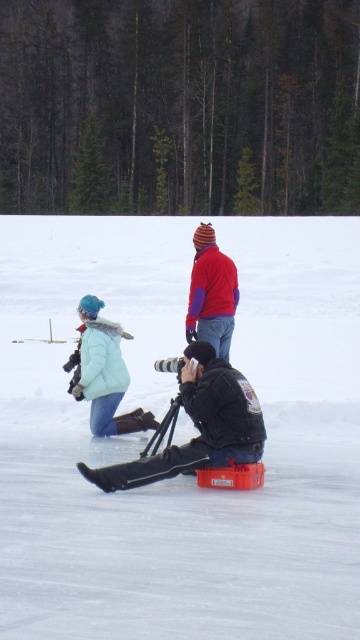
You are a photographer setting up equipment on the ice. You have an orange plastic container at center and a matte teal jacket at lower left. Which object is closer to the right edge of the ice surface?

The orange plastic container at center is closer to the right edge of the ice surface because it is positioned to the right of the matte teal jacket at lower left.

You are a photographer setting up equipment in the snowy scene. You have an orange plastic container at center and a matte teal jacket at lower left. Which object has a greater width?

The orange plastic container at center has a greater width than the matte teal jacket at lower left.

You are standing at the edge of the frozen lake and want to take a photo of both the dark blue leather jacket at lower center and the matte teal jacket at lower left. Which jacket should you focus on first to ensure both are in the frame?

You should focus on the dark blue leather jacket at lower center first since it is closer to the viewer, ensuring both jackets are within the camera frame.